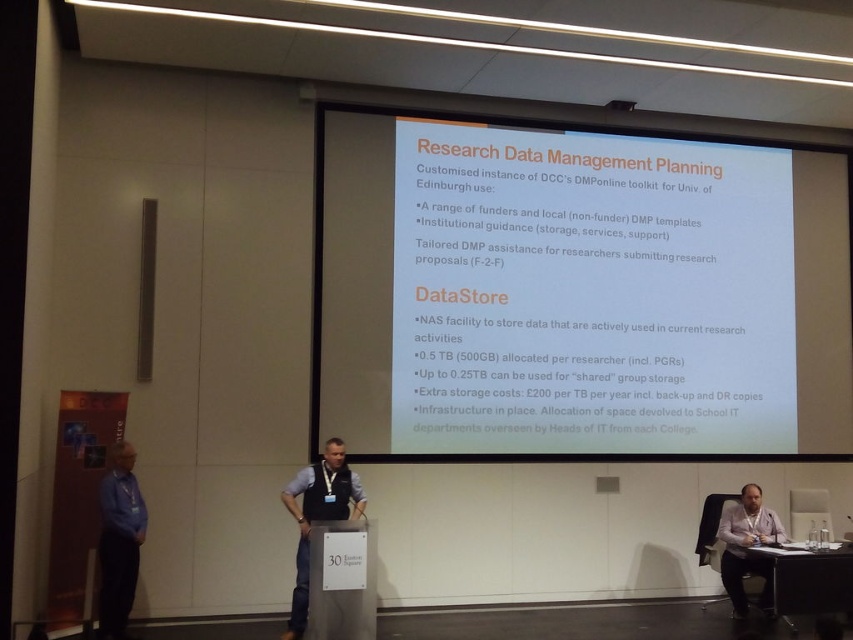
Can you confirm if white paper at center is thinner than dark gray shirt at center?

In fact, white paper at center might be wider than dark gray shirt at center.

Is white paper at center closer to camera compared to dark gray shirt at center?

No, it is behind dark gray shirt at center.

The width and height of the screenshot is (853, 640). Identify the location of white paper at center. (577, 292).

Where is `blue fabric shirt at lower left`? This screenshot has height=640, width=853. blue fabric shirt at lower left is located at coordinates (119, 541).

Is the position of blue fabric shirt at lower left more distant than that of black plastic table at lower right?

No, it is in front of black plastic table at lower right.

Is point (123, 472) closer to camera compared to point (825, 598)?

That is True.

Find the location of a particular element. This screenshot has width=853, height=640. blue fabric shirt at lower left is located at coordinates (119, 541).

Which is above, white paper at center or blue fabric shirt at lower left?

white paper at center is higher up.

Who is positioned more to the right, white paper at center or blue fabric shirt at lower left?

white paper at center is more to the right.

Find the location of a particular element. white paper at center is located at coordinates (577, 292).

This screenshot has width=853, height=640. Find the location of `white paper at center`. white paper at center is located at coordinates (577, 292).